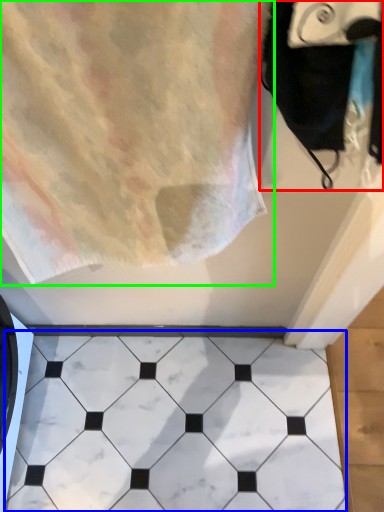
Question: Estimate the real-world distances between objects in this image. Which object is farther from bath towel (highlighted by a red box), marble (highlighted by a blue box) or towel (highlighted by a green box)?

Choices:
 (A) marble
 (B) towel

Answer: (A)